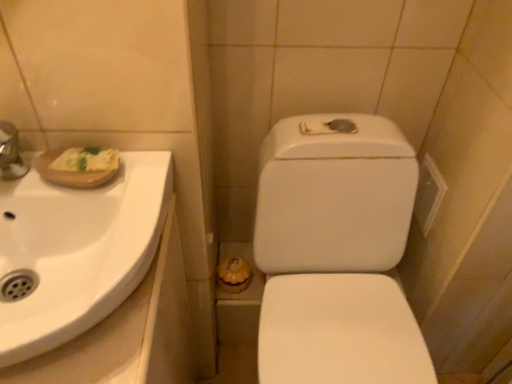
Question: From a real-world perspective, is white glossy sink at upper left below white glossy toilet at center?

Choices:
 (A) no
 (B) yes

Answer: (A)

Question: Does white glossy sink at upper left have a greater height compared to white glossy toilet at center?

Choices:
 (A) no
 (B) yes

Answer: (A)

Question: Is white glossy sink at upper left oriented away from white glossy toilet at center?

Choices:
 (A) no
 (B) yes

Answer: (A)

Question: Does white glossy sink at upper left touch white glossy toilet at center?

Choices:
 (A) no
 (B) yes

Answer: (A)

Question: Is white glossy sink at upper left outside of white glossy toilet at center?

Choices:
 (A) no
 (B) yes

Answer: (B)

Question: Is white glossy sink at upper left to the left of white glossy toilet at center from the viewer's perspective?

Choices:
 (A) yes
 (B) no

Answer: (A)

Question: Is white glossy toilet at center in contact with white glossy sink at upper left?

Choices:
 (A) yes
 (B) no

Answer: (B)

Question: Considering the relative positions of white glossy toilet at center and white glossy sink at upper left in the image provided, is white glossy toilet at center to the left of white glossy sink at upper left from the viewer's perspective?

Choices:
 (A) yes
 (B) no

Answer: (B)

Question: Is the position of white glossy toilet at center more distant than that of white glossy sink at upper left?

Choices:
 (A) yes
 (B) no

Answer: (A)

Question: Is white glossy toilet at center taller than white glossy sink at upper left?

Choices:
 (A) yes
 (B) no

Answer: (A)

Question: From the image's perspective, is white glossy toilet at center under white glossy sink at upper left?

Choices:
 (A) no
 (B) yes

Answer: (B)

Question: Is white glossy toilet at center outside of white glossy sink at upper left?

Choices:
 (A) yes
 (B) no

Answer: (A)

Question: Do you think white glossy sink at upper left is within white glossy toilet at center, or outside of it?

Choices:
 (A) inside
 (B) outside

Answer: (B)